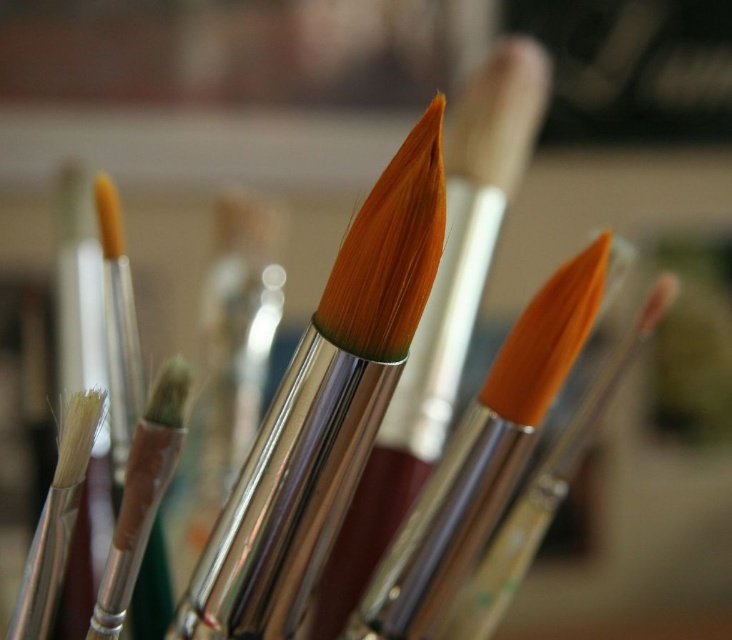
Is translucent plastic paint brush at center below white soft bristles at left?

Yes.

Between translucent plastic paint brush at center and white soft bristles at left, which one appears on the right side from the viewer's perspective?

translucent plastic paint brush at center is more to the right.

Image resolution: width=732 pixels, height=640 pixels. I want to click on translucent plastic paint brush at center, so click(x=141, y=493).

Is orange-bristled paintbrush at center shorter than orange matte paint brush at center?

In fact, orange-bristled paintbrush at center may be taller than orange matte paint brush at center.

Is orange-bristled paintbrush at center behind orange matte paint brush at center?

No, it is not.

Where is `orange-bristled paintbrush at center`? The image size is (732, 640). orange-bristled paintbrush at center is located at coordinates (324, 408).

Locate an element on the screen. This screenshot has width=732, height=640. orange-bristled paintbrush at center is located at coordinates (324, 408).

Who is lower down, orange-bristled paintbrush at center or orange metallic paint brush at center?

orange metallic paint brush at center

The image size is (732, 640). Identify the location of orange-bristled paintbrush at center. (324, 408).

Between point (302, 540) and point (523, 554), which one is positioned in front?

Point (302, 540)

Where is `orange-bristled paintbrush at center`? This screenshot has width=732, height=640. orange-bristled paintbrush at center is located at coordinates (324, 408).